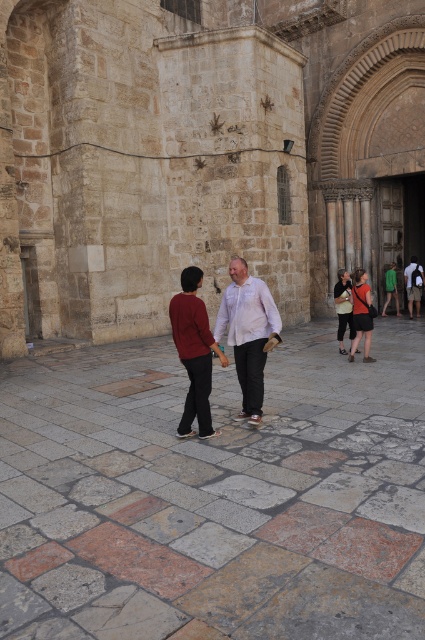
You are standing in front of the historic stone building and want to walk from the stone paved courtyard at center to the green fabric shirt at right. Which direction should you move relative to your current position?

You should move upward because the stone paved courtyard at center is located below the green fabric shirt at right.

You are standing in front of the historic stone building and want to walk to the stone paved courtyard at center. Which direction should you walk to reach it?

The stone paved courtyard at center is located at point (215, 493), so you should walk forward to reach it since it is directly in front of you.